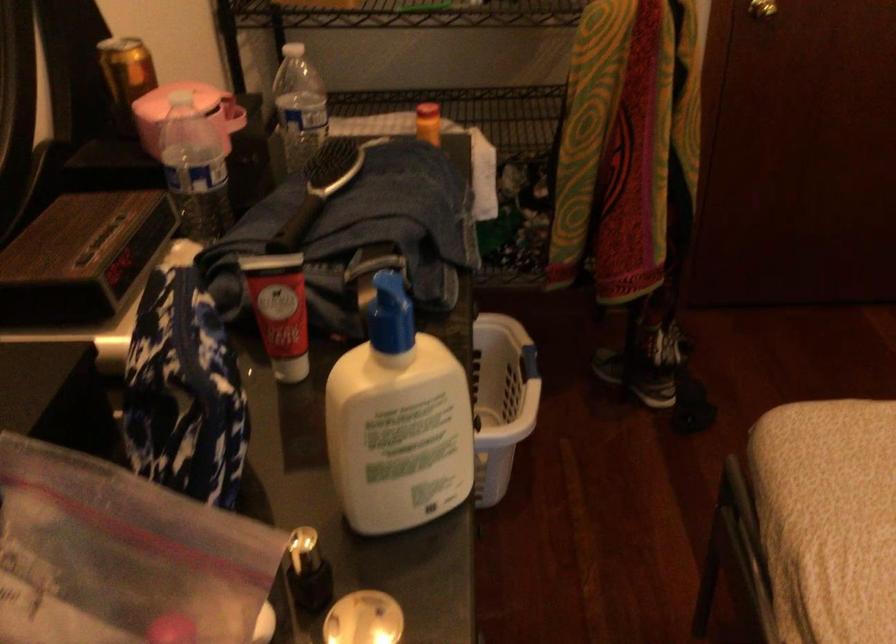
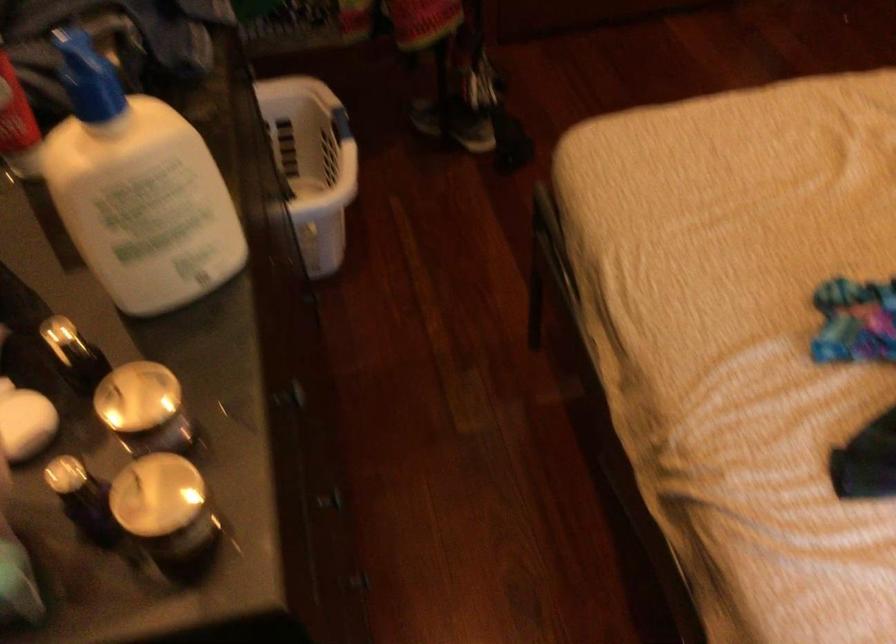
The point at [495,395] is marked in the first image. Where is the corresponding point in the second image?

(312, 164)